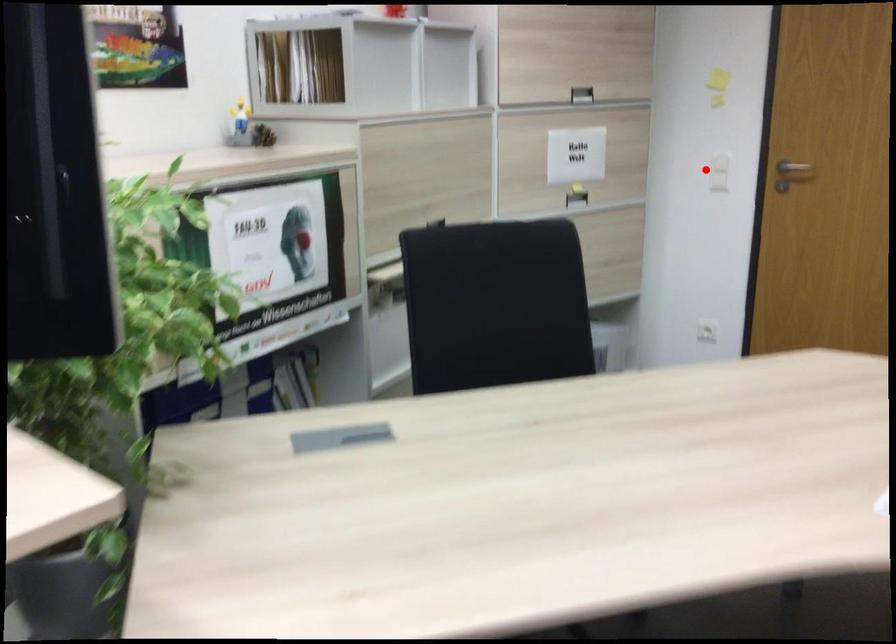
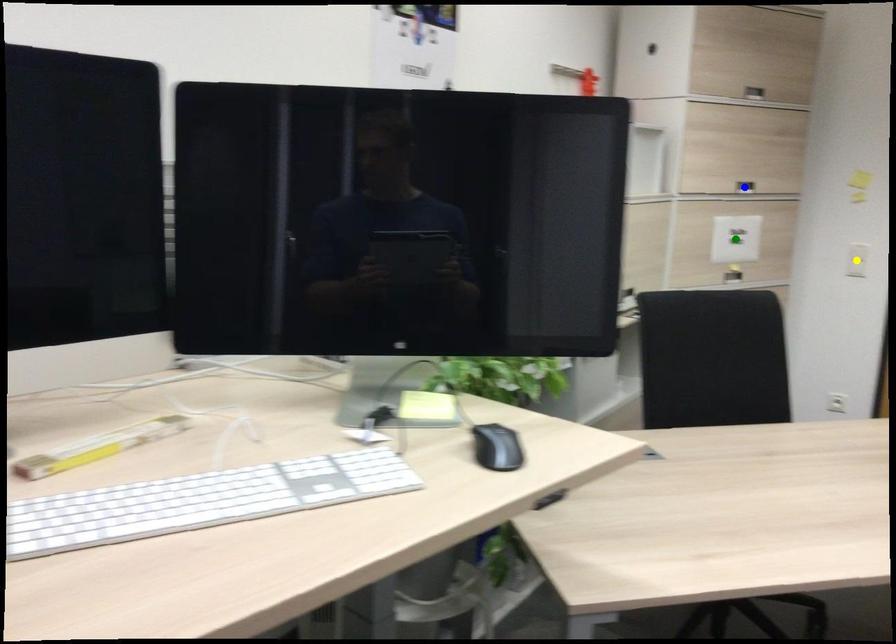
Question: I am providing you with two images of the same scene from different viewpoints. A red point is marked on the first image. You are given multiple points on the second image. Which point in image 2 is actually the same real-world point as the red point in image 1?

Choices:
 (A) yellow point
 (B) blue point
 (C) green point

Answer: (A)